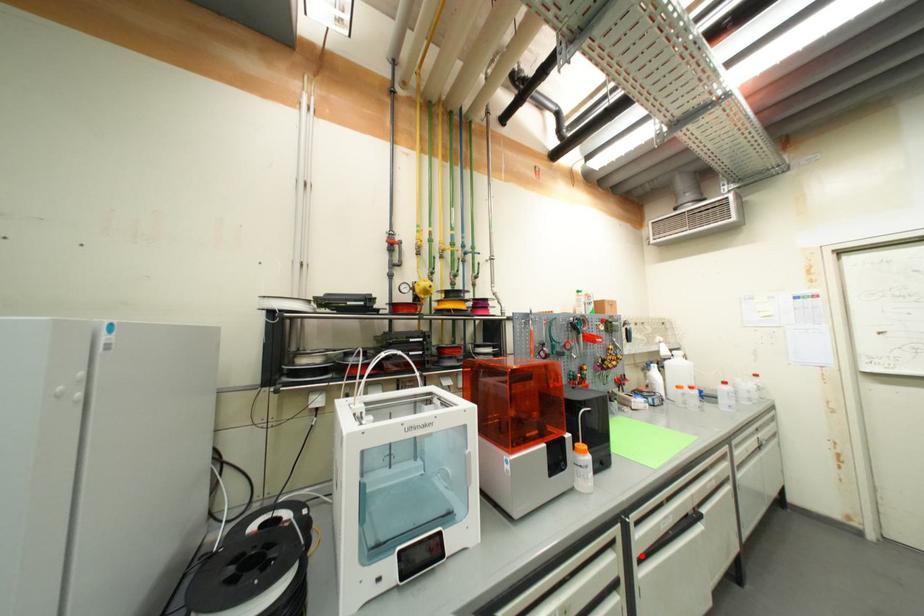
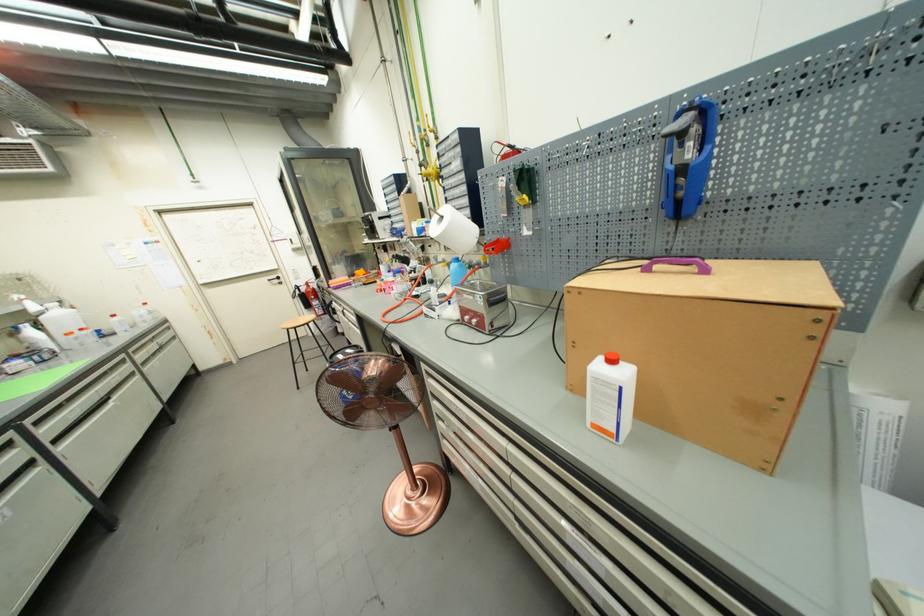
Question: I am providing you with two images of the same scene from different viewpoints. In image1, a red point is highlighted. Considering the same 3D point in image2, which of the following is correct?

Choices:
 (A) It is closer
 (B) It is farther

Answer: (B)